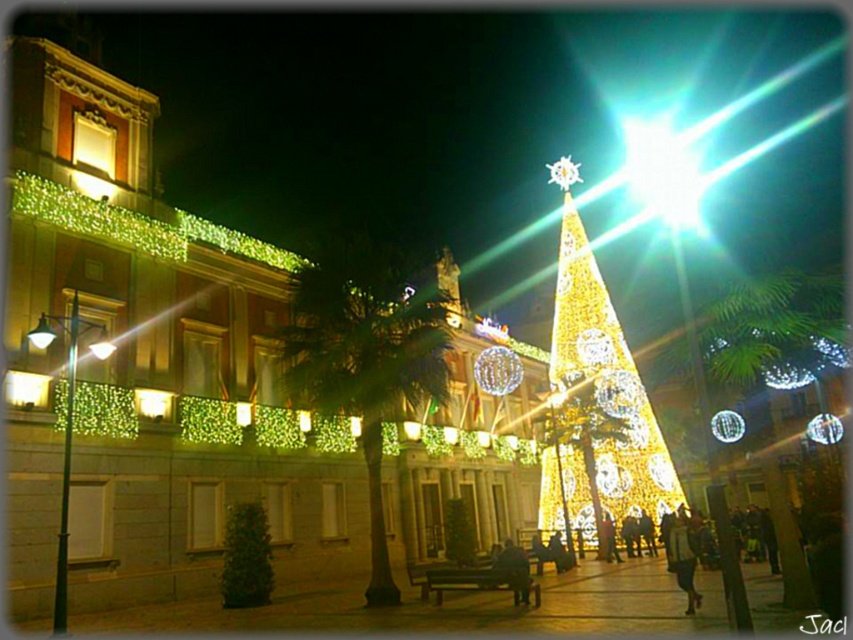
Question: Is green leafy palm tree at center to the left of illuminated gold christmas tree at center from the viewer's perspective?

Choices:
 (A) no
 (B) yes

Answer: (B)

Question: Is green leafy palm tree at center to the left of illuminated gold christmas tree at center from the viewer's perspective?

Choices:
 (A) no
 (B) yes

Answer: (B)

Question: Which of the following is the farthest from the observer?

Choices:
 (A) illuminated gold christmas tree at center
 (B) green leafy palm tree at center

Answer: (A)

Question: Which point is closer to the camera taking this photo?

Choices:
 (A) click(x=564, y=291)
 (B) click(x=312, y=385)

Answer: (B)

Question: Is green leafy palm tree at center in front of illuminated gold christmas tree at center?

Choices:
 (A) no
 (B) yes

Answer: (B)